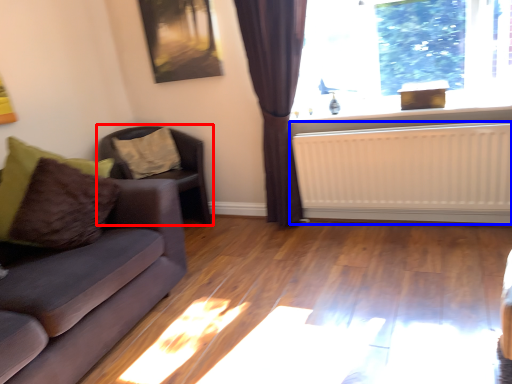
Question: Which point is closer to the camera, chair (highlighted by a red box) or radiator (highlighted by a blue box)?

Choices:
 (A) chair
 (B) radiator

Answer: (B)